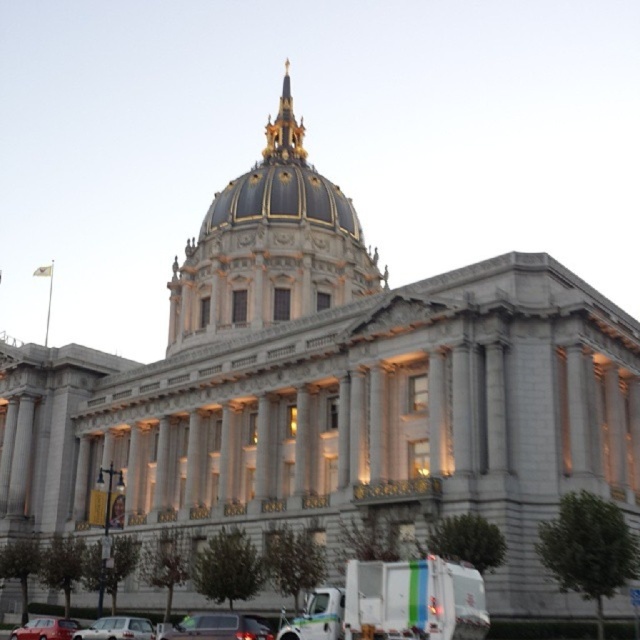
You are an architect analyzing the symmetry of the grand neoclassical building. The point marked at coordinates (269, 244) corresponds to the center of the dome. If the building is perfectly symmetrical along its central axis, where would the corresponding point be on the opposite side of the dome?

Since the building is perfectly symmetrical along its central axis, the corresponding point on the opposite side of the dome would also be at coordinates (269, 244), as the center point remains the same in a symmetrical structure.

You are driving a car and want to park in the parking spot between the silver metallic sedan at lower center and the shiny red car at lower left. Which car should you move closer to if you want to park in the narrower space?

The silver metallic sedan at lower center is thinner than the shiny red car at lower left, so the narrower space is likely near the silver metallic sedan at lower center. Move closer to the silver metallic sedan at lower center to park in the narrower space.